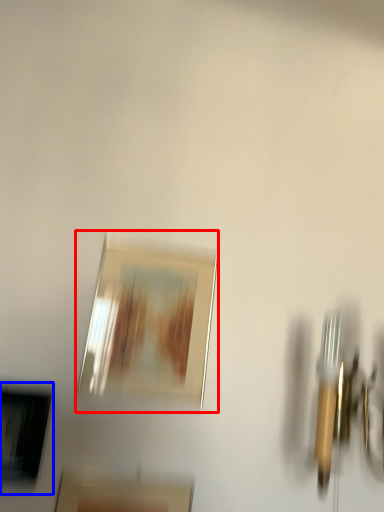
Question: Which object is further to the camera taking this photo, picture frame (highlighted by a red box) or picture frame (highlighted by a blue box)?

Choices:
 (A) picture frame
 (B) picture frame

Answer: (A)